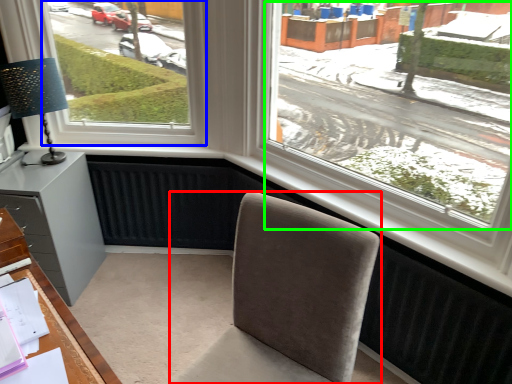
Question: Which is farther away from chair (highlighted by a red box)? window (highlighted by a blue box) or window screen (highlighted by a green box)?

Choices:
 (A) window
 (B) window screen

Answer: (A)